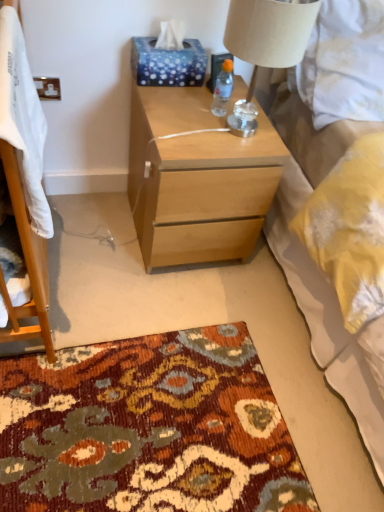
Question: Is blue dotted tissue at upper center positioned beyond the bounds of white soft blanket at left?

Choices:
 (A) no
 (B) yes

Answer: (B)

Question: Does blue dotted tissue at upper center turn towards white soft blanket at left?

Choices:
 (A) yes
 (B) no

Answer: (B)

Question: Considering the relative sizes of blue dotted tissue at upper center and white soft blanket at left in the image provided, is blue dotted tissue at upper center shorter than white soft blanket at left?

Choices:
 (A) yes
 (B) no

Answer: (A)

Question: Is white soft blanket at left surrounded by blue dotted tissue at upper center?

Choices:
 (A) no
 (B) yes

Answer: (A)

Question: Does blue dotted tissue at upper center come in front of white soft blanket at left?

Choices:
 (A) yes
 (B) no

Answer: (B)

Question: Is blue dotted tissue at upper center inside the boundaries of white textured bed at upper right, or outside?

Choices:
 (A) outside
 (B) inside

Answer: (A)

Question: Based on their sizes in the image, would you say blue dotted tissue at upper center is bigger or smaller than white textured bed at upper right?

Choices:
 (A) big
 (B) small

Answer: (B)

Question: From a real-world perspective, relative to white textured bed at upper right, is blue dotted tissue at upper center vertically above or below?

Choices:
 (A) above
 (B) below

Answer: (A)

Question: In the image, is blue dotted tissue at upper center positioned in front of or behind white textured bed at upper right?

Choices:
 (A) behind
 (B) front

Answer: (A)

Question: Considering the relative positions of light wood/finish nightstand at center and beige fabric lampshade at upper right in the image provided, is light wood/finish nightstand at center to the left or to the right of beige fabric lampshade at upper right?

Choices:
 (A) left
 (B) right

Answer: (A)

Question: Considering the positions of light wood/finish nightstand at center and beige fabric lampshade at upper right in the image, is light wood/finish nightstand at center wider or thinner than beige fabric lampshade at upper right?

Choices:
 (A) wide
 (B) thin

Answer: (A)

Question: Does point (246, 145) appear closer or farther from the camera than point (297, 4)?

Choices:
 (A) closer
 (B) farther

Answer: (B)

Question: Is light wood/finish nightstand at center taller or shorter than beige fabric lampshade at upper right?

Choices:
 (A) tall
 (B) short

Answer: (A)

Question: Is blue dotted tissue at upper center taller or shorter than transparent plastic bottle at upper center?

Choices:
 (A) tall
 (B) short

Answer: (A)

Question: Is blue dotted tissue at upper center to the left or to the right of transparent plastic bottle at upper center in the image?

Choices:
 (A) left
 (B) right

Answer: (A)